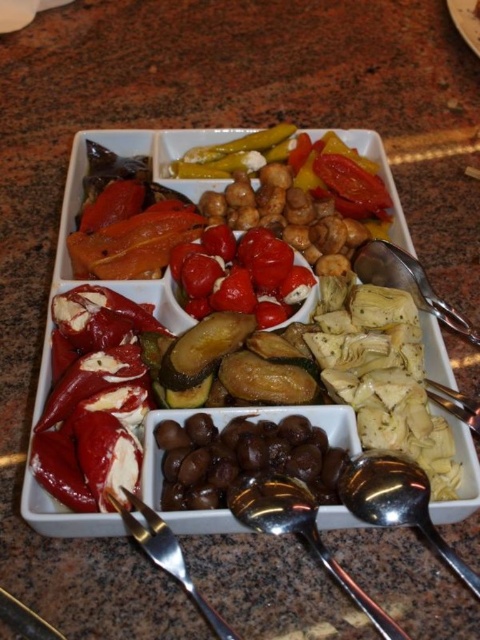
You are standing in front of the serving platter and want to reach both the point at coordinates point [342,472] and point [276,486]. Which point should you reach for first to minimize the distance traveled?

Point [342,472] is closer to you than point [276,486] because it is further to the viewer. Therefore, you should reach for point [342,472] first to minimize the distance traveled.

You are a diner at a buffet, and you see the satin silver spoon at lower right and the silver metallic fork at lower left on the table. You want to grab both utensils to serve yourself. Can you reach both without moving your hand from the initial position if your hand can cover a 8 inch area?

The distance between the satin silver spoon at lower right and silver metallic fork at lower left is 7.92 inches, which is just under 8 inches. Therefore, you can reach both without moving your hand since the distance is within the 8 inch coverage area.

You are looking at the serving platter from above. There are two points marked on the platter, one at point coordinates point (27, 477) and another at point coordinates point (414, 276). Which point is closer to you?

Point (27, 477) is closer to you than point (414, 276).